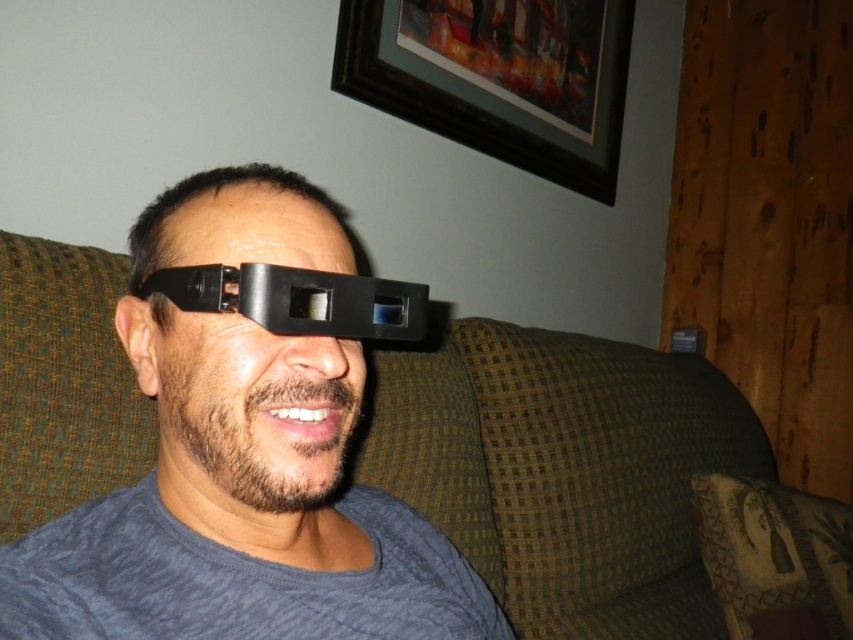
Measure the distance from black matte glasses at center to black matte/glossy goggles at center.

They are 10.90 centimeters apart.

Who is shorter, black matte glasses at center or black matte/glossy goggles at center?

Standing shorter between the two is black matte/glossy goggles at center.

This screenshot has height=640, width=853. In order to click on black matte glasses at center in this screenshot , I will do `click(241, 465)`.